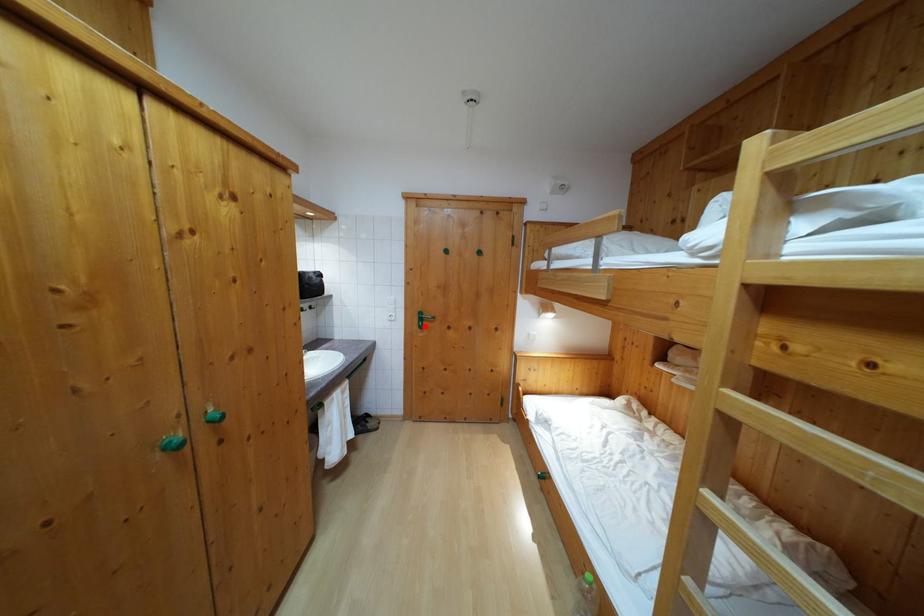
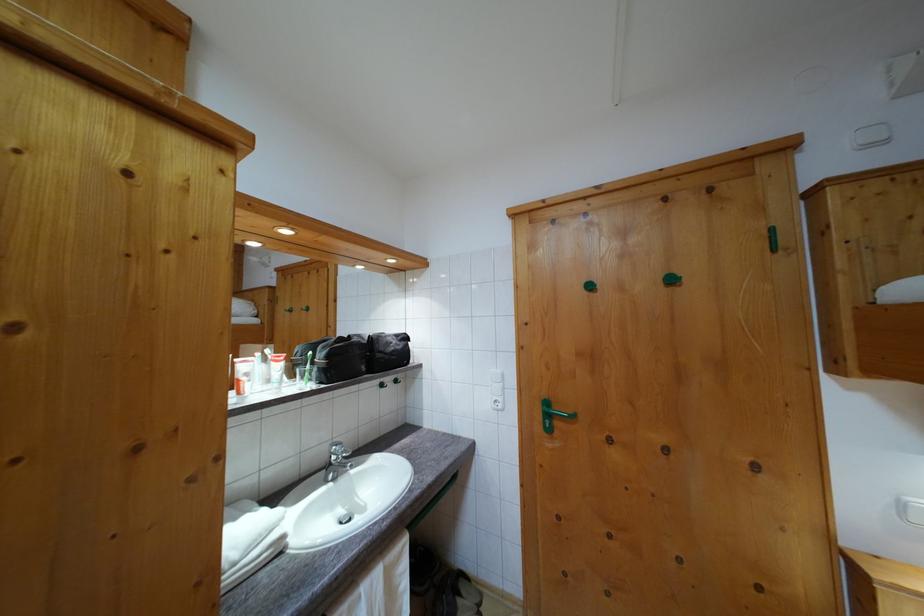
Locate, in the second image, the point that corresponds to the highlighted location in the first image.

(552, 422)